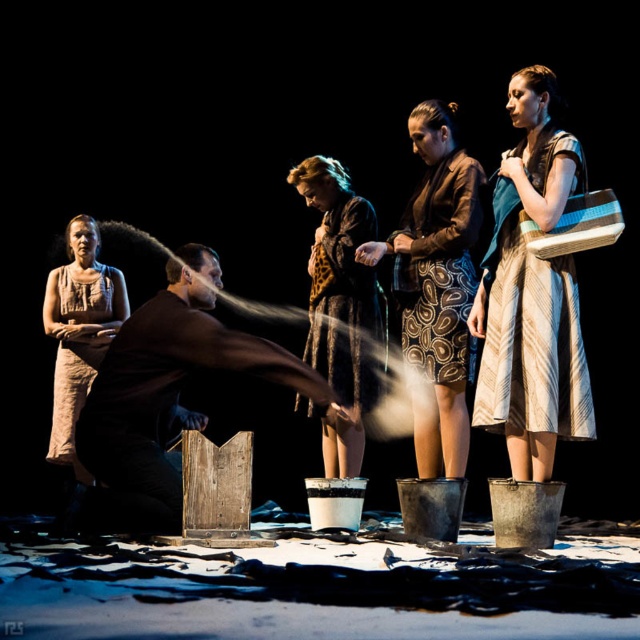
Question: Is striped fabric dress at right to the right of textured brown dress at center from the viewer's perspective?

Choices:
 (A) yes
 (B) no

Answer: (A)

Question: Which point appears farthest from the camera in this image?

Choices:
 (A) (60, 294)
 (B) (161, 346)

Answer: (A)

Question: Which point is closer to the camera taking this photo?

Choices:
 (A) (429, 372)
 (B) (556, 278)

Answer: (B)

Question: Considering the real-world distances, which object is closest to the beige textured dress at left?

Choices:
 (A) brown textured dress at center
 (B) dark brown leather man at center
 (C) textured brown dress at center
 (D) striped fabric dress at right

Answer: (C)

Question: Does dark brown leather man at center appear on the right side of beige textured dress at left?

Choices:
 (A) yes
 (B) no

Answer: (A)

Question: Is brown textured skirt at center closer to camera compared to beige textured dress at left?

Choices:
 (A) yes
 (B) no

Answer: (A)